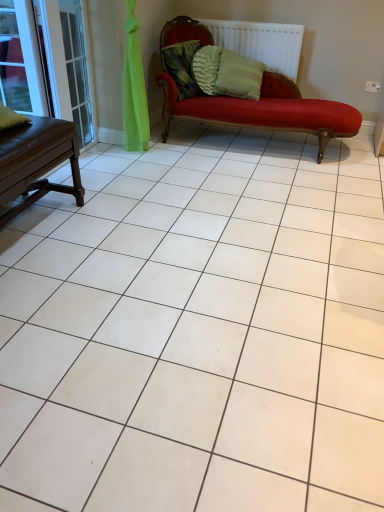
Question: Is textured green pillow at upper center, which is the 2th pillow in right-to-left order, shorter than clear glass window at upper left?

Choices:
 (A) yes
 (B) no

Answer: (A)

Question: From a real-world perspective, is textured green pillow at upper center, which is the 1th pillow from left to right, physically below clear glass window at upper left?

Choices:
 (A) yes
 (B) no

Answer: (A)

Question: Does textured green pillow at upper center, which is the 1th pillow from left to right, contain clear glass window at upper left?

Choices:
 (A) yes
 (B) no

Answer: (B)

Question: Is textured green pillow at upper center, which is the 1th pillow from left to right, to the right of clear glass window at upper left from the viewer's perspective?

Choices:
 (A) yes
 (B) no

Answer: (A)

Question: Is textured green pillow at upper center, which is the 2th pillow in right-to-left order, bigger than clear glass window at upper left?

Choices:
 (A) no
 (B) yes

Answer: (B)

Question: From the image's perspective, relative to white textured radiator at upper center, is textured green pillow at upper center, which is the 1th pillow from left to right, above or below?

Choices:
 (A) above
 (B) below

Answer: (B)

Question: From a real-world perspective, is textured green pillow at upper center, which is the 1th pillow from left to right, positioned above or below white textured radiator at upper center?

Choices:
 (A) above
 (B) below

Answer: (B)

Question: Is point (188, 89) positioned closer to the camera than point (225, 45)?

Choices:
 (A) closer
 (B) farther

Answer: (A)

Question: Is textured green pillow at upper center, which is the 1th pillow from left to right, wider or thinner than white textured radiator at upper center?

Choices:
 (A) thin
 (B) wide

Answer: (B)

Question: Is textured green pillow at center, the first pillow viewed from the right, in front of or behind white textured radiator at upper center in the image?

Choices:
 (A) front
 (B) behind

Answer: (A)

Question: In terms of width, does textured green pillow at center, which appears as the 2th pillow when viewed from the left, look wider or thinner when compared to white textured radiator at upper center?

Choices:
 (A) wide
 (B) thin

Answer: (A)

Question: Would you say textured green pillow at center, the first pillow viewed from the right, is inside or outside white textured radiator at upper center?

Choices:
 (A) outside
 (B) inside

Answer: (A)

Question: In the image, is textured green pillow at center, the first pillow viewed from the right, on the left side or the right side of white textured radiator at upper center?

Choices:
 (A) right
 (B) left

Answer: (B)

Question: Looking at the image, does white textured radiator at upper center seem bigger or smaller compared to clear glass screen door at left?

Choices:
 (A) small
 (B) big

Answer: (B)

Question: Considering the positions of point (251, 49) and point (69, 92), is point (251, 49) closer or farther from the camera than point (69, 92)?

Choices:
 (A) closer
 (B) farther

Answer: (B)